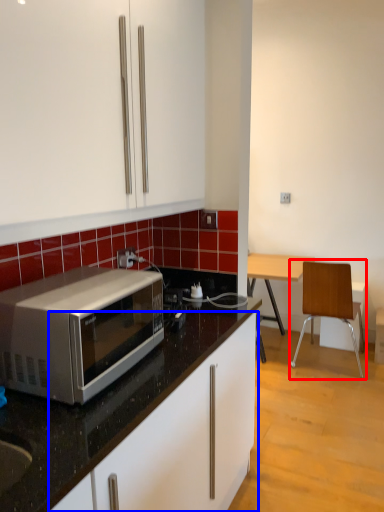
Question: Which object appears closest to the camera in this image, chair (highlighted by a red box) or cabinetry (highlighted by a blue box)?

Choices:
 (A) chair
 (B) cabinetry

Answer: (B)